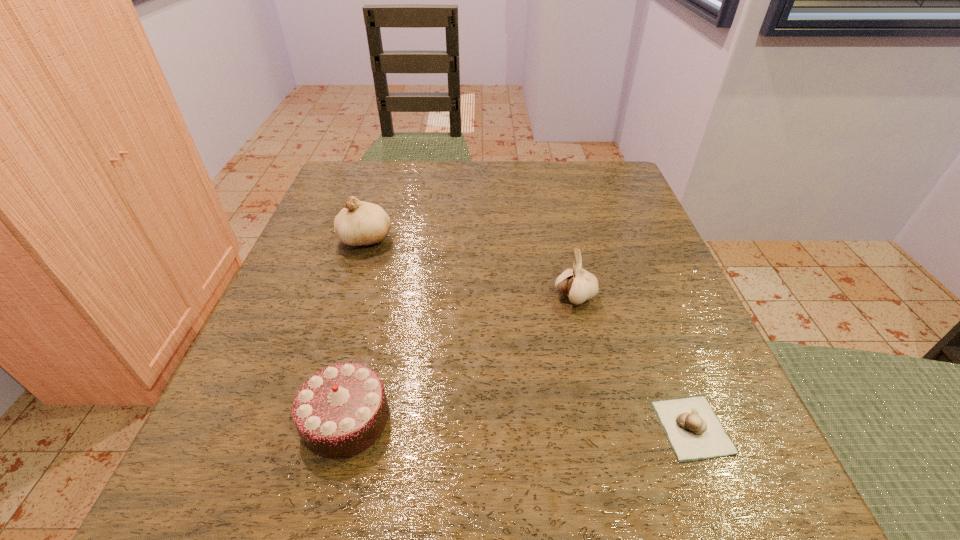
Locate an element on the screen. Image resolution: width=960 pixels, height=540 pixels. free region that satisfies the following two spatial constraints: 1. on the back side of the second garlic from right to left; 2. on the right side of the chocolate cake is located at coordinates (376, 297).